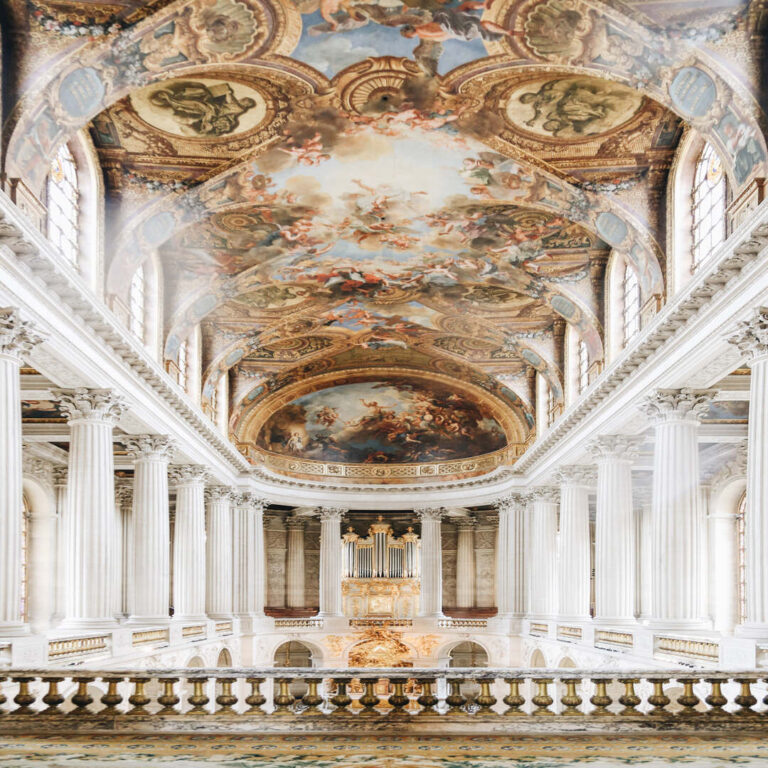
Identify the location of marble floor. (363, 743).